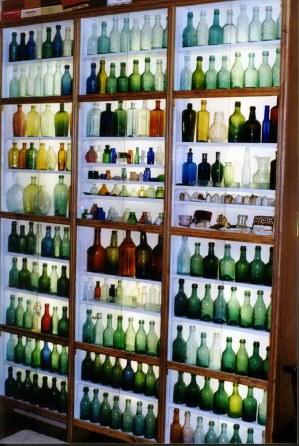
Where is `dark space under shelves`? dark space under shelves is located at coordinates (84, 437), (56, 431).